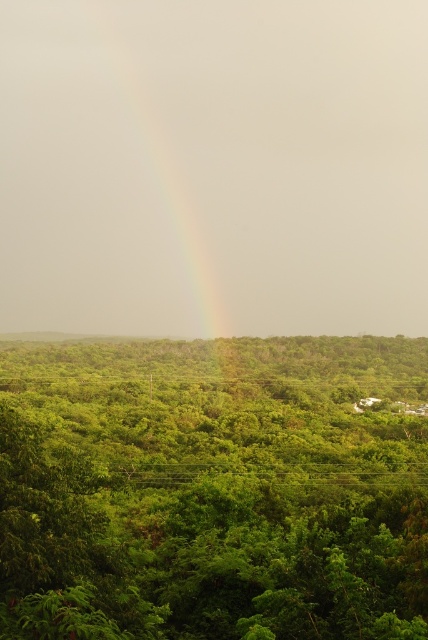
You are an ornithologist observing this tropical landscape. You notice a green leafy tree at center and a rainbow at center. Which object is closer to the ground?

The green leafy tree at center is closer to the ground because it is shorter than the rainbow at center.

You are a bird flying through the lush landscape. You notice a green leafy tree at center and a rainbow at center. Which object appears smaller from your perspective?

The green leafy tree at center appears smaller compared to the rainbow at center.